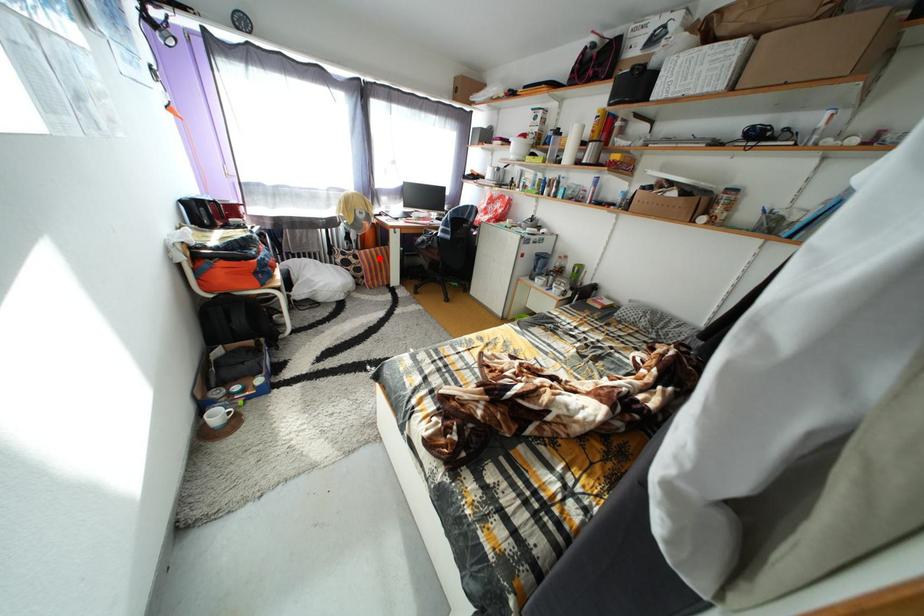
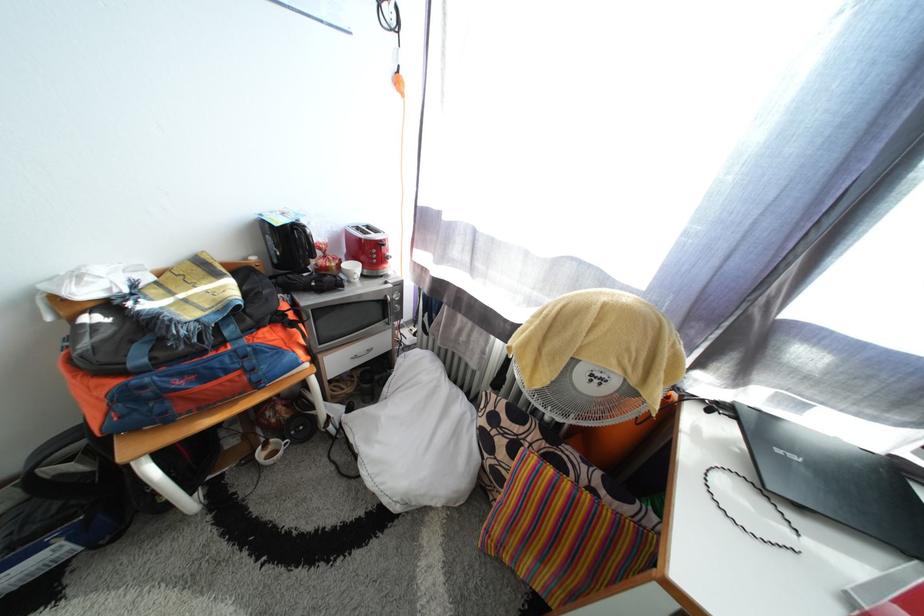
Question: A red point is marked in image1. In image2, is the corresponding 3D point closer to the camera or farther? Reply with the corresponding letter.

Choices:
 (A) The corresponding 3D point is closer.
 (B) The corresponding 3D point is farther.

Answer: (B)